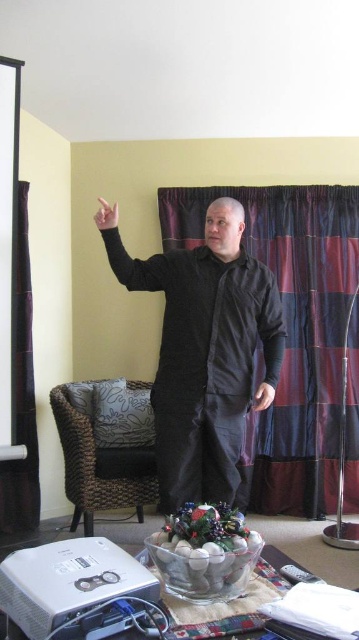
Can you confirm if black cotton robe at center is smaller than matte black hand at upper left?

No, black cotton robe at center is not smaller than matte black hand at upper left.

Is black cotton robe at center behind matte black hand at upper left?

Yes.

Which is in front, point (146, 285) or point (109, 225)?

Point (109, 225) is more forward.

In order to click on black cotton robe at center in this screenshot , I will do `click(203, 362)`.

Between point (34, 502) and point (136, 282), which one is positioned behind?

Positioned behind is point (34, 502).

Describe the element at coordinates (21, 394) in the screenshot. I see `velvet curtain at left` at that location.

The width and height of the screenshot is (359, 640). In order to click on velvet curtain at left in this screenshot , I will do pos(21,394).

Based on the photo, can you confirm if black matte shirt at upper center is positioned to the right of black matte arm at upper left?

Indeed, black matte shirt at upper center is positioned on the right side of black matte arm at upper left.

Between black matte shirt at upper center and black matte arm at upper left, which one appears on the right side from the viewer's perspective?

black matte shirt at upper center

Who is more distant from viewer, [269,378] or [155,288]?

Positioned behind is point [269,378].

Identify the location of black matte shirt at upper center. (268, 337).